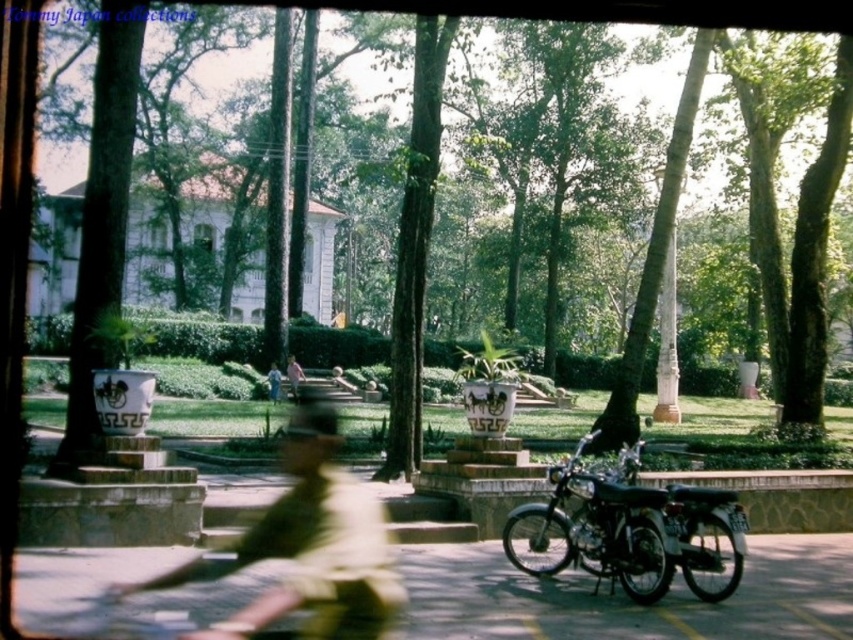
You are a photographer trying to capture the blue fabric person at center and the shiny chrome motorcycle at center in a single shot. Can you position yourself so that the motorcycle is not directly under the person in your photo?

The shiny chrome motorcycle at center is positioned under the blue fabric person at center, so it would be difficult to capture them in a single shot without the motorcycle being directly under the person unless you adjust your angle or move to a different position.

You are planning to take a photo of the shiny chrome motorcycle at center and the blue fabric person at center. Since the motorcycle is wider than the person, how should you position your camera to capture both subjects in the frame without cropping either?

Since the shiny chrome motorcycle at center is wider than the blue fabric person at center, you should position your camera closer to the motorcycle to ensure both subjects fit within the frame without cropping. This adjustment accounts for the motorcycle being wider, allowing both to be captured adequately.

You are a photographer planning to take a photo of the camouflage uniform at center. The camera is set to focus at point (x=308, y=547). Will the camouflage uniform at center be in focus?

Yes, the camouflage uniform at center is exactly at point (x=308, y=547), so it will be in focus.